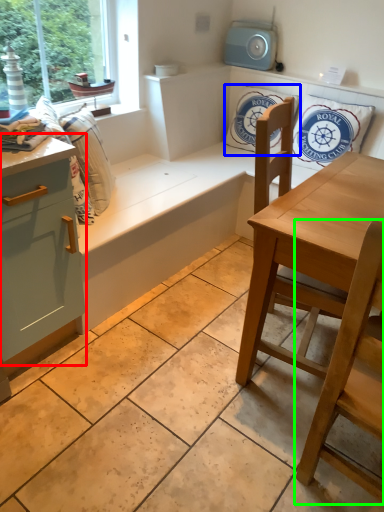
Question: Estimate the real-world distances between objects in this image. Which object is closer to cabinetry (highlighted by a red box), pillow (highlighted by a blue box) or chair (highlighted by a green box)?

Choices:
 (A) pillow
 (B) chair

Answer: (B)